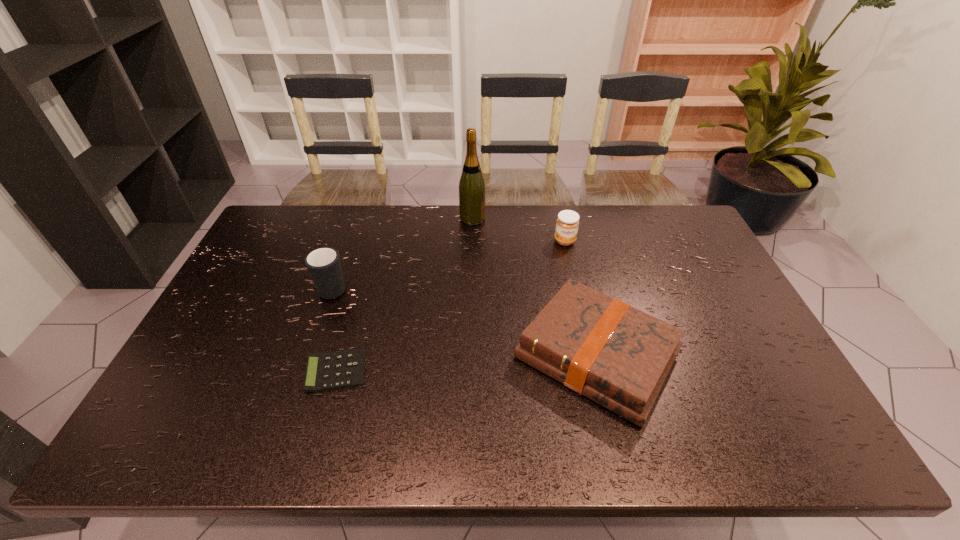
Locate an element on the screen. This screenshot has height=540, width=960. free space located 0.300m on the front label of the fourth nearest object is located at coordinates (581, 315).

I want to click on free space located on the left of the hardback book, so click(376, 355).

Locate an element on the screen. Image resolution: width=960 pixels, height=540 pixels. free space located 0.200m on the left of the calculator is located at coordinates (227, 371).

The image size is (960, 540). Find the location of `wine bottle that is at the far edge`. wine bottle that is at the far edge is located at coordinates (472, 190).

In order to click on jam that is positioned at the far edge in this screenshot , I will do `click(567, 223)`.

At what (x,y) coordinates should I click in order to perform the action: click on object that is at the near edge. Please return your answer as a coordinate pair (x, y). Image resolution: width=960 pixels, height=540 pixels. Looking at the image, I should click on (618, 356).

What are the coordinates of `vacant space at the far edge of the desktop` in the screenshot? It's located at (571, 210).

In the image, there is a desktop. Identify the location of vacant region at the near edge. (421, 428).

Identify the location of free space at the left edge of the desktop. (280, 271).

Find the location of a particular element. This screenshot has width=960, height=540. vacant space at the right edge is located at coordinates (694, 252).